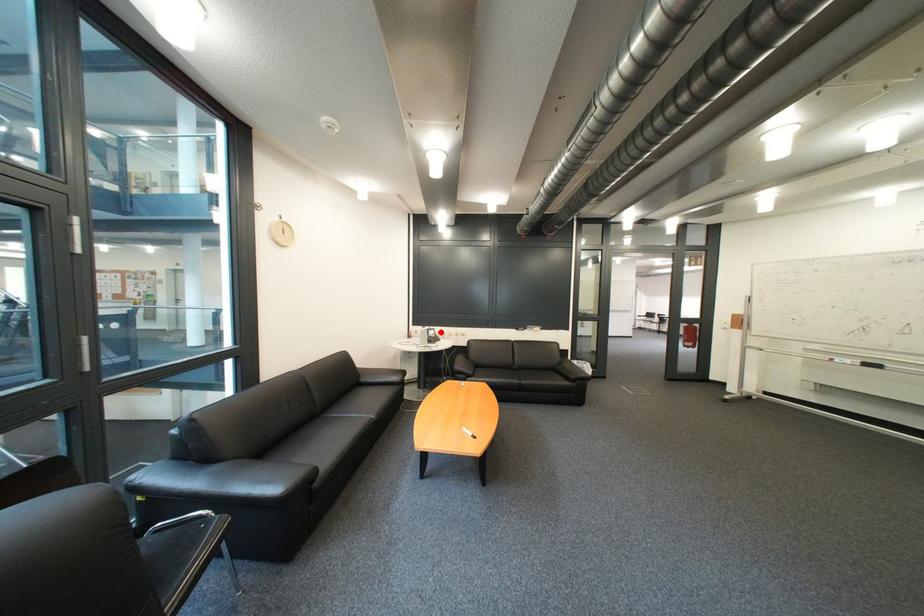
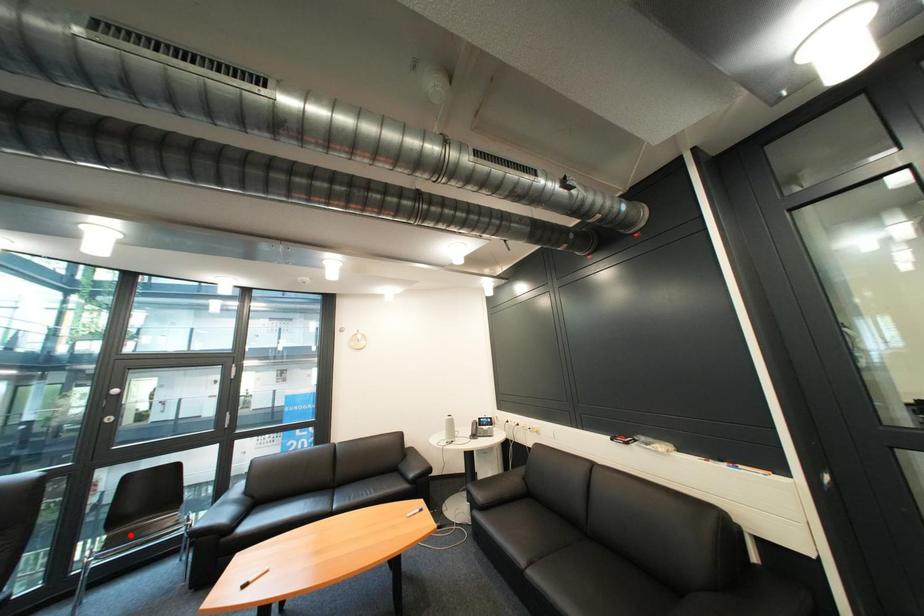
I am providing you with two images of the same scene from different viewpoints. A red point is marked on the first image and another point is marked on the second image. Is the marked point in image1 the same physical position as the marked point in image2?

No